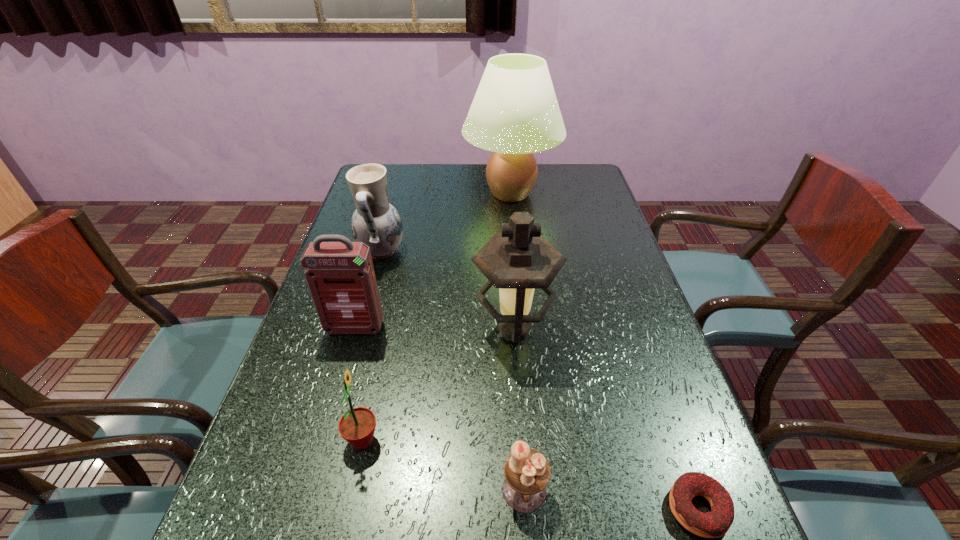
This screenshot has width=960, height=540. I want to click on lampshade, so point(515,113).

The image size is (960, 540). I want to click on the tallest object, so click(x=515, y=113).

Locate an element on the screen. oil lamp is located at coordinates (518, 260).

Where is `the first-aid kit`? This screenshot has height=540, width=960. the first-aid kit is located at coordinates (340, 275).

This screenshot has width=960, height=540. I want to click on the sixth nearest object, so click(375, 222).

In order to click on sunflower in this screenshot , I will do `click(357, 426)`.

I want to click on the fifth farthest object, so click(357, 426).

The width and height of the screenshot is (960, 540). I want to click on the sixth tallest object, so click(x=527, y=472).

Find the location of `free region located on the shade of the tallest object`. free region located on the shade of the tallest object is located at coordinates (517, 256).

Find the location of a particular element. vacant space situated on the right of the oil lamp is located at coordinates (623, 329).